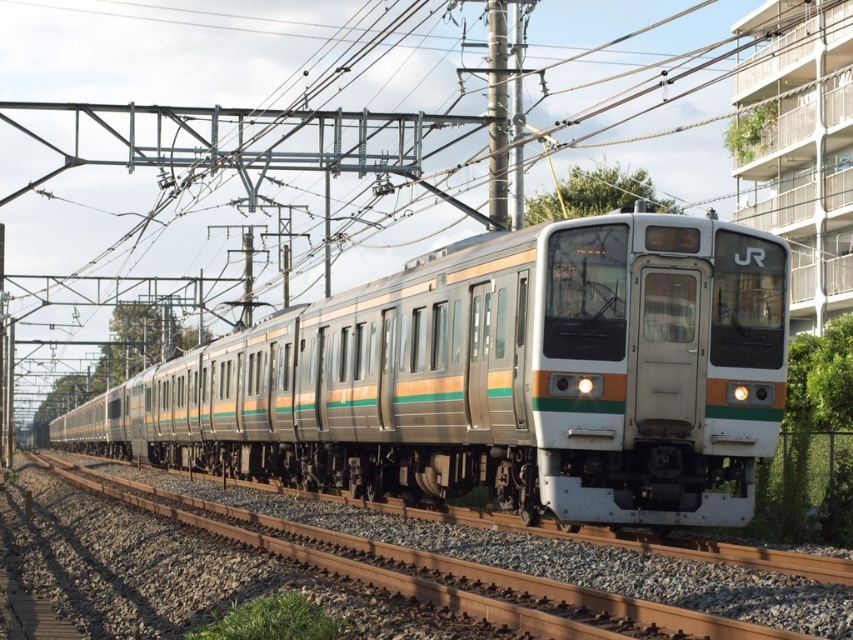
Question: Which point is farther to the camera?

Choices:
 (A) (228, 508)
 (B) (257, 400)

Answer: (B)

Question: Does silver metallic train at center appear under brown gravel at lower left?

Choices:
 (A) yes
 (B) no

Answer: (B)

Question: Can you confirm if silver metallic train at center is bigger than brown gravel at lower left?

Choices:
 (A) yes
 (B) no

Answer: (A)

Question: Is silver metallic train at center to the right of brown gravel at lower left from the viewer's perspective?

Choices:
 (A) yes
 (B) no

Answer: (B)